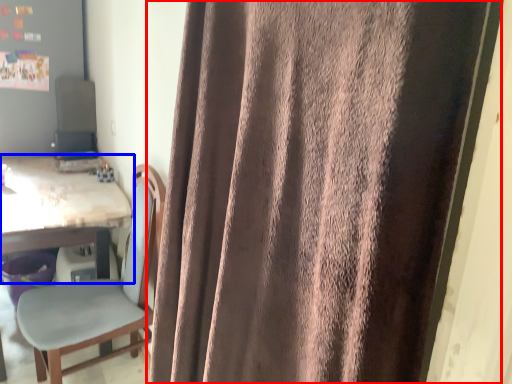
Question: Which object is closer to the camera taking this photo, curtain (highlighted by a red box) or table (highlighted by a blue box)?

Choices:
 (A) curtain
 (B) table

Answer: (A)